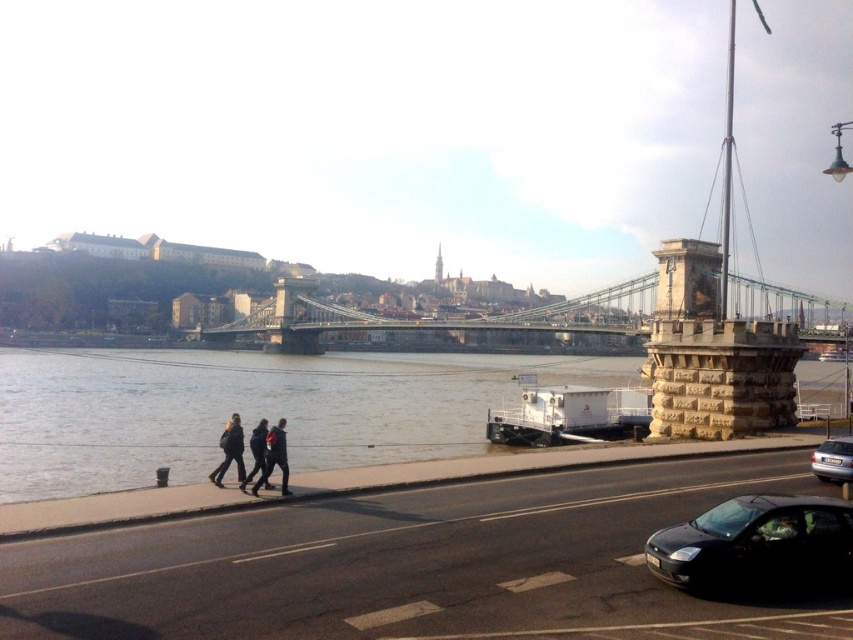
Based on the photo, you are standing at the point with coordinates point (229, 369) and want to walk towards the point with coordinates point (229, 452). Which direction should you move?

You should move away from the viewer because point (229, 369) is closer to the viewer than point (229, 452).

You are standing at the point closer to the camera in the image. Which point are you at, point (763, 280) or point (248, 477)?

You are at point (763, 280) because it is further to the viewer than point (248, 477).